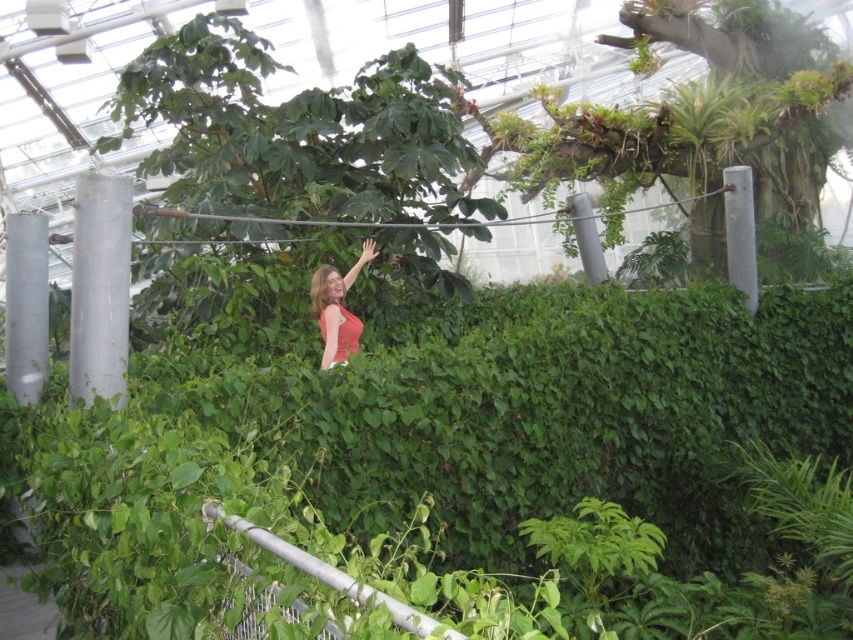
Does green leafy hedge at center come behind matte red dress at center?

No, green leafy hedge at center is closer to the viewer.

Which of these two, green leafy hedge at center or matte red dress at center, stands shorter?

matte red dress at center

Is point (563, 486) farther from viewer compared to point (312, 282)?

No, (563, 486) is in front of (312, 282).

This screenshot has width=853, height=640. In order to click on green leafy hedge at center in this screenshot , I will do `click(432, 445)`.

Is silver metallic rail at center to the left of matte red dress at center from the viewer's perspective?

In fact, silver metallic rail at center is to the right of matte red dress at center.

Is silver metallic rail at center wider than matte red dress at center?

Yes.

Identify the location of silver metallic rail at center. This screenshot has height=640, width=853. (322, 570).

Is green leafy hedge at center above silver metallic rail at center?

No.

The image size is (853, 640). What do you see at coordinates (432, 445) in the screenshot?
I see `green leafy hedge at center` at bounding box center [432, 445].

Locate an element on the screen. green leafy hedge at center is located at coordinates (432, 445).